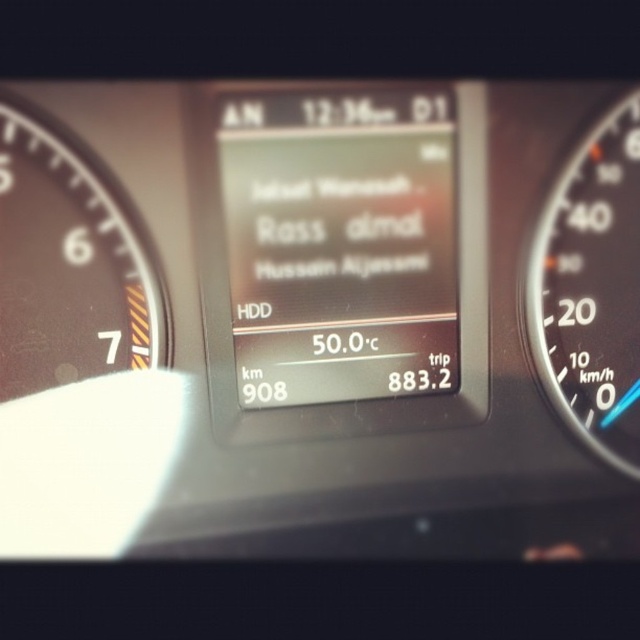
You are a mechanic inspecting a car dashboard. You need to reach the point at coordinates point (147, 349) to check a sensor. Your tool is 0.5 meters long. Can you safely reach the point without extending beyond the dashboard?

The point (147, 349) is 1.07 meters away from the camera. Since your tool is only 0.5 meters long, you cannot safely reach it without extending beyond the dashboard.

You are a mechanic trying to install a new sensor between the matte black gauge at left and the black plastic speedometer at right. The sensor requires a minimum of 25 inches of space. Can you fit it there?

The matte black gauge at left is 26.33 inches away from the black plastic speedometer at right, so yes, the sensor can be installed between them since the distance is sufficient.

You are a driver checking the dashboard of your car. You notice the matte black gauge at left. Where exactly is it positioned on the dashboard?

The matte black gauge at left is located at point (x=70, y=262) on the dashboard.